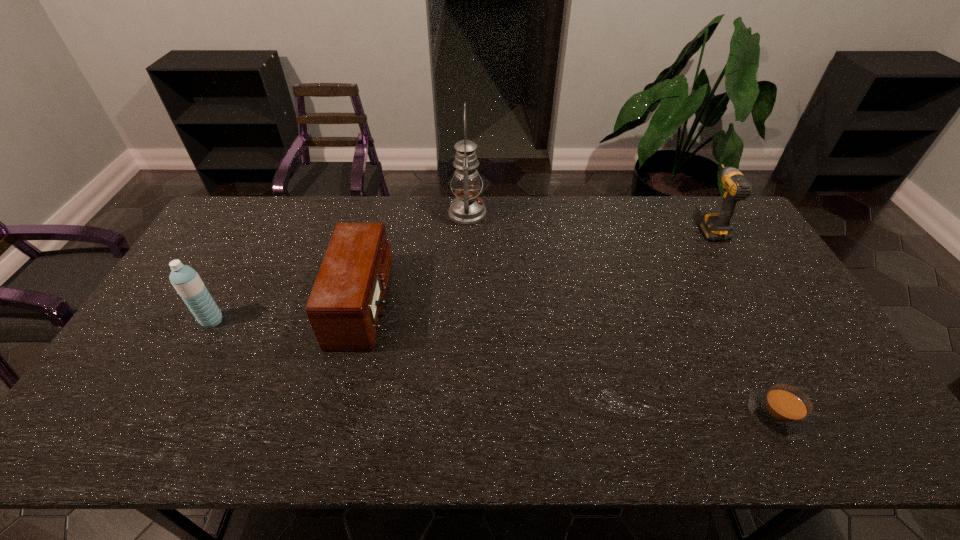
Locate an element on the screen. This screenshot has width=960, height=540. object situated at the near right corner is located at coordinates (782, 410).

In the image, there is a desktop. Find the location of `free space at the far edge`. free space at the far edge is located at coordinates (306, 201).

This screenshot has width=960, height=540. In the image, there is a desktop. Identify the location of vacant space at the near edge. pos(278,424).

The height and width of the screenshot is (540, 960). In the image, there is a desktop. What are the coordinates of `vacant region at the left edge` in the screenshot? It's located at (205, 259).

Locate an element on the screen. The height and width of the screenshot is (540, 960). vacant region at the right edge is located at coordinates (714, 254).

Identify the location of free space at the far left corner of the desktop. The width and height of the screenshot is (960, 540). (233, 198).

In the image, there is a desktop. Where is `vacant space at the near left corner`? The height and width of the screenshot is (540, 960). vacant space at the near left corner is located at coordinates click(x=126, y=426).

In the image, there is a desktop. Find the location of `vacant space at the far right corner`. vacant space at the far right corner is located at coordinates (711, 210).

This screenshot has height=540, width=960. I want to click on vacant point located between the leftmost object and the fourth object from right to left, so click(288, 313).

The image size is (960, 540). What are the coordinates of `vacant area that lies between the shortest object and the third object from left to right` in the screenshot? It's located at (622, 314).